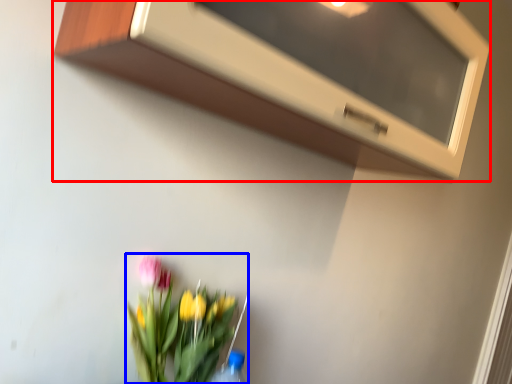
Question: Which object appears farthest to the camera in this image, microwave (highlighted by a red box) or floral arrangement (highlighted by a blue box)?

Choices:
 (A) microwave
 (B) floral arrangement

Answer: (B)